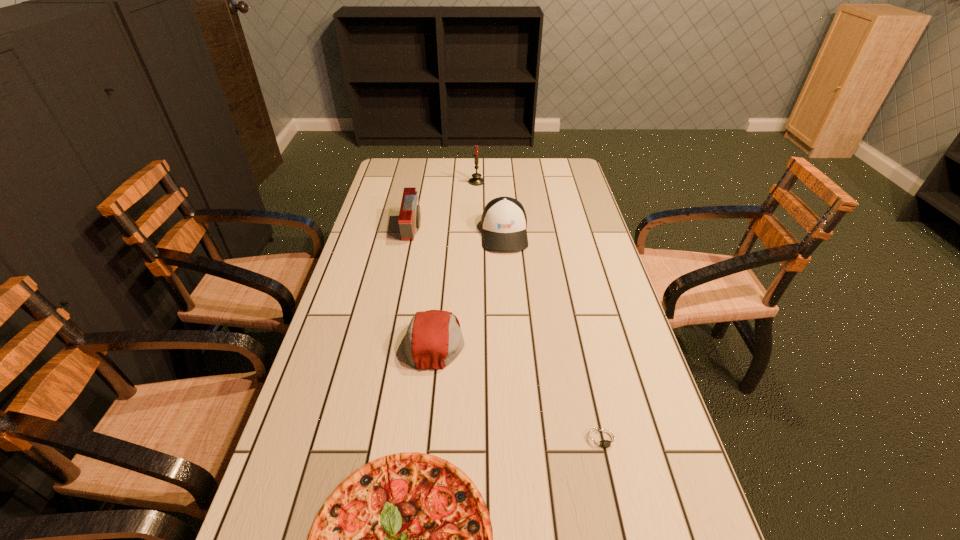
Locate an element on the screen. The image size is (960, 540). vacant area that lies between the farthest object and the fourth tallest object is located at coordinates (456, 261).

Identify the location of vacant area that lies between the camera and the right cap. This screenshot has height=540, width=960. (459, 231).

In order to click on vacant space in between the farthest object and the shorter cap in this screenshot , I will do `click(456, 261)`.

The width and height of the screenshot is (960, 540). Find the location of `free space between the tallest object and the camera`. free space between the tallest object and the camera is located at coordinates (444, 205).

You are a GUI agent. You are given a task and a screenshot of the screen. Output one action in this format:
    pyautogui.click(x=<x>, y=<y>)
    Task: Click on the vacant region between the shorter cap and the farthest object
    Image resolution: width=960 pixels, height=540 pixels.
    Given the screenshot: What is the action you would take?
    pyautogui.click(x=456, y=261)

Identify the location of free space between the fourth farthest object and the camera. This screenshot has width=960, height=540. (424, 285).

Where is `free point between the camera and the rightmost object`? Image resolution: width=960 pixels, height=540 pixels. free point between the camera and the rightmost object is located at coordinates (508, 334).

You are a GUI agent. You are given a task and a screenshot of the screen. Output one action in this format:
    pyautogui.click(x=<x>, y=<y>)
    Task: Click on the free spot between the rightmost object and the camera
    The height and width of the screenshot is (540, 960).
    Given the screenshot: What is the action you would take?
    pyautogui.click(x=508, y=334)

The image size is (960, 540). Identify the location of the fourth closest object to the watch. (409, 219).

Point out which object is positioned as the second nearest to the fifth tallest object. Please provide its 2D coordinates. Your answer should be formatted as a tuple, i.e. [(x, y)], where the tuple contains the x and y coordinates of a point satisfying the conditions above.

[(433, 340)]